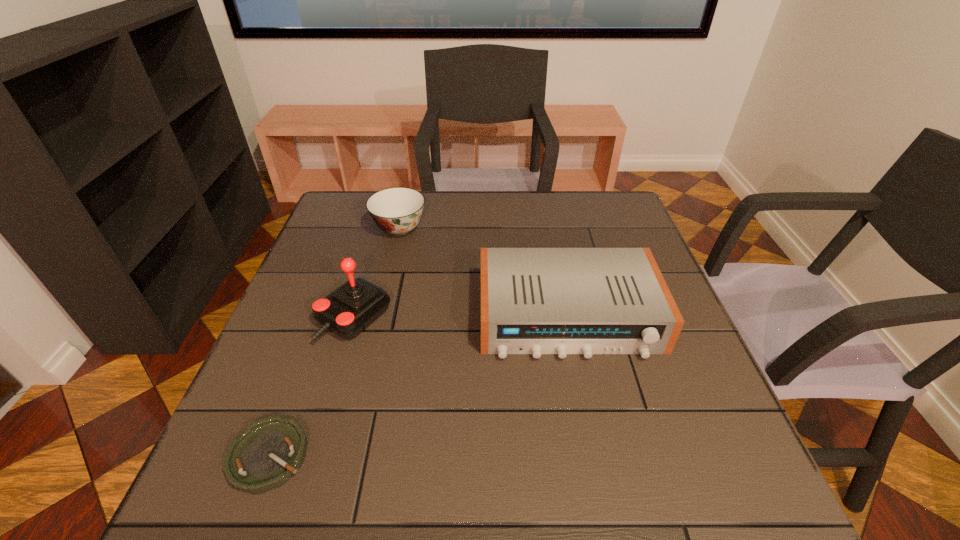
In the image, there is a desktop. Identify the location of vacant space at the near right corner. This screenshot has width=960, height=540. (726, 482).

Locate an element on the screen. The image size is (960, 540). vacant area that lies between the radio receiver and the nearest object is located at coordinates (419, 386).

You are a GUI agent. You are given a task and a screenshot of the screen. Output one action in this format:
    pyautogui.click(x=<x>, y=<y>)
    Task: Click on the free space between the soup bowl and the ashtray
    Image resolution: width=960 pixels, height=540 pixels.
    Given the screenshot: What is the action you would take?
    pyautogui.click(x=334, y=342)

What are the coordinates of `free space between the tallest object and the nearest object` in the screenshot? It's located at pos(311,387).

Where is `empty location between the radio receiver and the joystick`? The image size is (960, 540). empty location between the radio receiver and the joystick is located at coordinates (462, 317).

The image size is (960, 540). Identify the location of free area in between the shortest object and the tallest object. click(x=311, y=387).

You are a GUI agent. You are given a task and a screenshot of the screen. Output one action in this format:
    pyautogui.click(x=<x>, y=<y>)
    Task: Click on the empty space that is in between the rightmost object and the joystick
    
    Given the screenshot: What is the action you would take?
    pyautogui.click(x=462, y=317)

Where is `free space between the rightmost object and the tallest object`? The width and height of the screenshot is (960, 540). free space between the rightmost object and the tallest object is located at coordinates (462, 317).

You are a GUI agent. You are given a task and a screenshot of the screen. Output one action in this format:
    pyautogui.click(x=<x>, y=<y>)
    Task: Click on the free space between the soup bowl and the nearest object
    
    Given the screenshot: What is the action you would take?
    pyautogui.click(x=334, y=342)

This screenshot has width=960, height=540. Find the location of `free space between the radio receiver and the shortest object`. free space between the radio receiver and the shortest object is located at coordinates (419, 386).